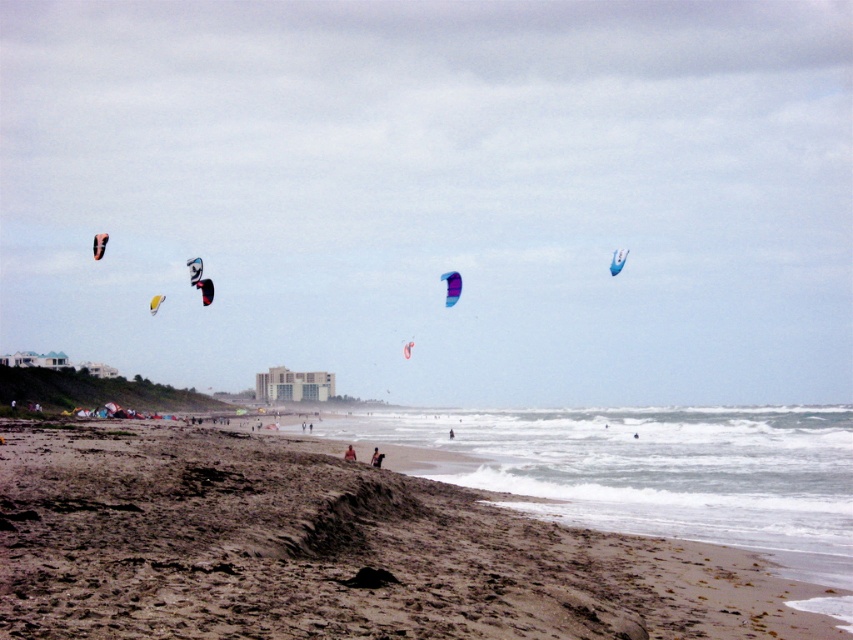
Question: Is transparent kite at upper center closer to camera compared to brown sandy beach at lower left?

Choices:
 (A) no
 (B) yes

Answer: (A)

Question: Based on their relative distances, which object is farther from the brown sandy beach at lower left?

Choices:
 (A) matte black parachute at upper left
 (B) blue glossy parachute at upper center

Answer: (A)

Question: Which of the following is the closest to the observer?

Choices:
 (A) dark blue wetsuit at center
 (B) brown leather jacket at center
 (C) matte black parachute at upper left
 (D) blue glossy parachute at upper center

Answer: (B)

Question: Is the position of transparent kite at upper center less distant than that of brown leather jacket at center?

Choices:
 (A) yes
 (B) no

Answer: (B)

Question: Can you confirm if matte black parachute at upper left is wider than brown leather jacket at center?

Choices:
 (A) yes
 (B) no

Answer: (A)

Question: Which object is farther from the camera taking this photo?

Choices:
 (A) brown leather jacket at center
 (B) transparent kite at upper center
 (C) brown sandy beach at lower left

Answer: (B)